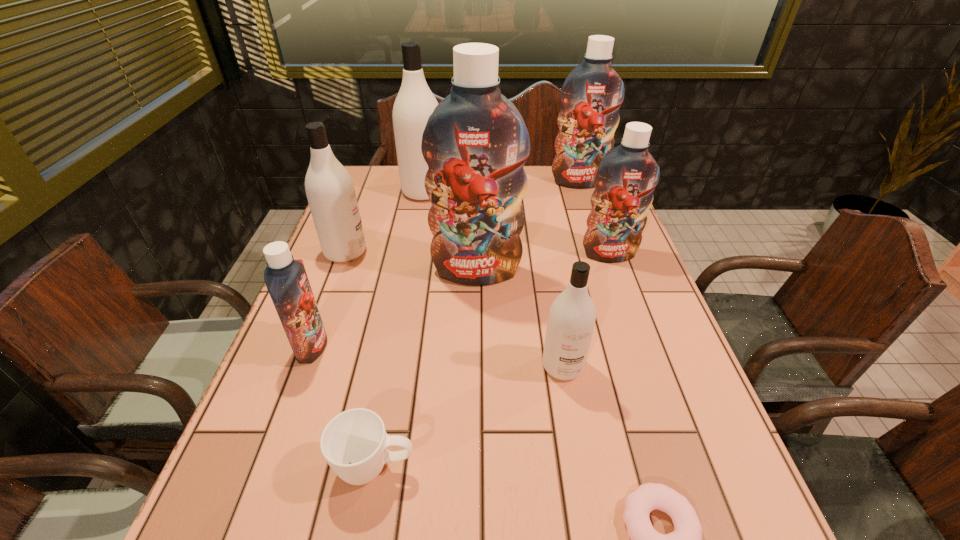
The height and width of the screenshot is (540, 960). I want to click on the second closest blue shampoo to the farthest white shampoo, so click(x=591, y=96).

Locate which white shampoo ranks second in proximity to the shortest object. Please provide its 2D coordinates. Your answer should be formatted as a tuple, i.e. [(x, y)], where the tuple contains the x and y coordinates of a point satisfying the conditions above.

[(330, 191)]

Identify the location of white shampoo that can be found as the second closest to the smallest blue shampoo. (572, 315).

The width and height of the screenshot is (960, 540). I want to click on free space that satisfies the following two spatial constraints: 1. on the front label of the third smallest blue shampoo; 2. on the front-facing side of the farthest white shampoo, so click(x=582, y=192).

I want to click on vacant position in the image that satisfies the following two spatial constraints: 1. on the front label of the farthest blue shampoo; 2. on the front-facing side of the biggest white shampoo, so [582, 192].